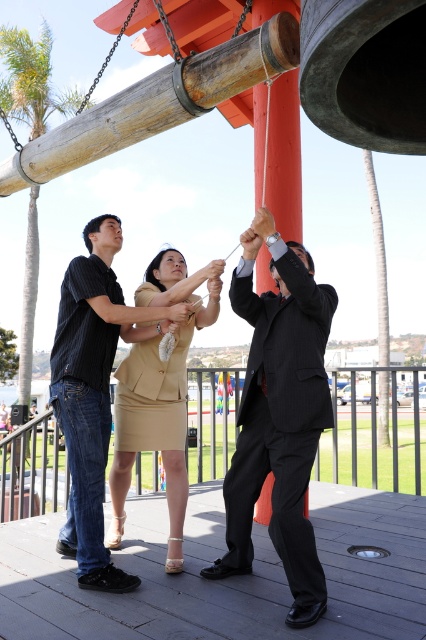
Question: In this image, where is beige fabric dress at center located relative to beige fabric skirt at center?

Choices:
 (A) above
 (B) below

Answer: (A)

Question: Is dark gray pinstripe suit at center to the right of dark blue jeans at center from the viewer's perspective?

Choices:
 (A) yes
 (B) no

Answer: (A)

Question: Which point appears closest to the camera in this image?

Choices:
 (A) (290, 276)
 (B) (163, 314)
 (C) (183, 470)

Answer: (A)

Question: Which of the following is the closest to the observer?

Choices:
 (A) beige fabric dress at center
 (B) dark gray pinstripe suit at center

Answer: (A)

Question: Can you confirm if dark gray pinstripe suit at center is positioned to the right of beige fabric skirt at center?

Choices:
 (A) no
 (B) yes

Answer: (B)

Question: Among these points, which one is farthest from the camera?

Choices:
 (A) (279, 390)
 (B) (131, 324)

Answer: (B)